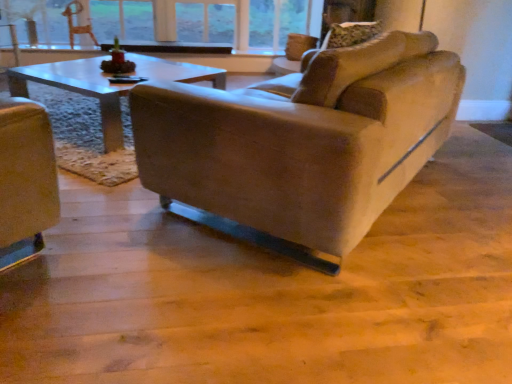
Question: Does clear glass window at upper center have a smaller size compared to suede-like beige couch at center?

Choices:
 (A) yes
 (B) no

Answer: (A)

Question: Does clear glass window at upper center have a lesser height compared to suede-like beige couch at center?

Choices:
 (A) no
 (B) yes

Answer: (B)

Question: From a real-world perspective, is clear glass window at upper center beneath suede-like beige couch at center?

Choices:
 (A) no
 (B) yes

Answer: (A)

Question: Is the depth of clear glass window at upper center greater than that of suede-like beige couch at center?

Choices:
 (A) no
 (B) yes

Answer: (B)

Question: Is clear glass window at upper center to the right of suede-like beige couch at center from the viewer's perspective?

Choices:
 (A) no
 (B) yes

Answer: (A)

Question: Choose the correct answer: Is wooden textured swivel chair at upper left inside clear glass window at upper center or outside it?

Choices:
 (A) outside
 (B) inside

Answer: (A)

Question: Considering the relative positions of wooden textured swivel chair at upper left and clear glass window at upper center in the image provided, is wooden textured swivel chair at upper left to the left or to the right of clear glass window at upper center?

Choices:
 (A) right
 (B) left

Answer: (B)

Question: Considering the positions of point [73, 13] and point [164, 18], is point [73, 13] closer or farther from the camera than point [164, 18]?

Choices:
 (A) closer
 (B) farther

Answer: (A)

Question: In terms of height, does wooden textured swivel chair at upper left look taller or shorter compared to clear glass window at upper center?

Choices:
 (A) tall
 (B) short

Answer: (B)

Question: From the image's perspective, relative to clear glass window at upper center, is suede-like beige couch at center above or below?

Choices:
 (A) below
 (B) above

Answer: (A)

Question: In terms of height, does suede-like beige couch at center look taller or shorter compared to clear glass window at upper center?

Choices:
 (A) short
 (B) tall

Answer: (B)

Question: Is suede-like beige couch at center wider or thinner than clear glass window at upper center?

Choices:
 (A) thin
 (B) wide

Answer: (B)

Question: Do you think suede-like beige couch at center is within clear glass window at upper center, or outside of it?

Choices:
 (A) outside
 (B) inside

Answer: (A)

Question: In the image, is suede-like beige couch at center positioned in front of or behind wooden textured swivel chair at upper left?

Choices:
 (A) behind
 (B) front

Answer: (B)

Question: Considering the positions of point (142, 84) and point (90, 36), is point (142, 84) closer or farther from the camera than point (90, 36)?

Choices:
 (A) farther
 (B) closer

Answer: (B)